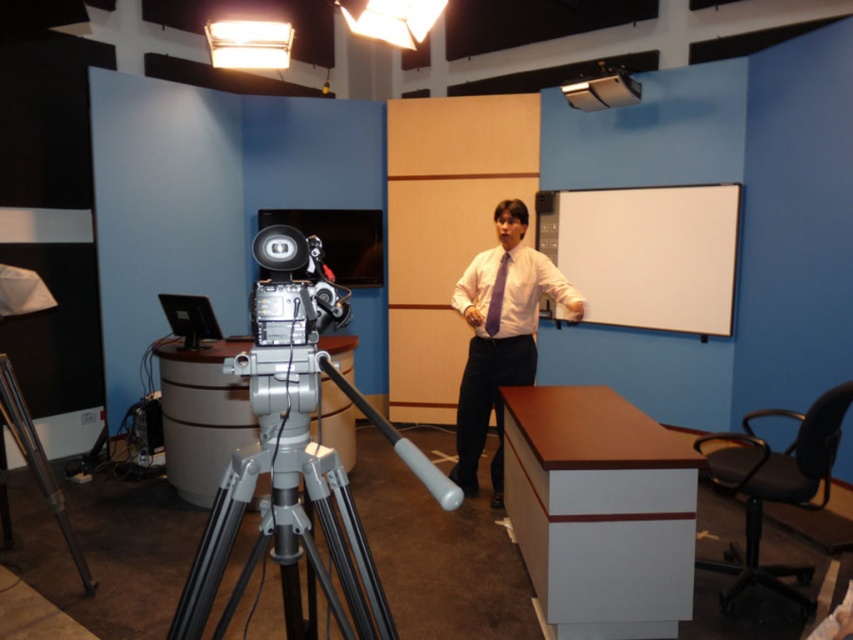
You are setting up a camera in the studio and need to ensure there is enough space between the silver metallic tripod at center and the white matte dress shirt at center. Based on their sizes, which object requires more space to accommodate its size?

The silver metallic tripod at center is bigger than the white matte dress shirt at center, so it requires more space to accommodate its size.

You are a camera operator in the studio. You need to adjust the camera angle to focus on the presenter without the tripod blocking the view. Based on the scene description, can you position the camera so that the white matte dress shirt at center is visible without the silver metallic tripod at center obscuring it?

The silver metallic tripod at center is positioned under the white matte dress shirt at center. This means the tripod is below the presenter, so adjusting the camera angle upwards should allow the white matte dress shirt at center to be visible without obstruction from the tripod.

Based on the photo, you are standing in the studio and want to adjust the camera to focus on the purple matte shirt at center. If the camera has a minimum focusing distance of 10 feet, will you need to move the camera closer or farther away?

The purple matte shirt at center and viewer are 10.38 feet apart. Since the minimum focusing distance is 10 feet, the camera is already within range. Therefore, you do not need to move the camera closer or farther away.